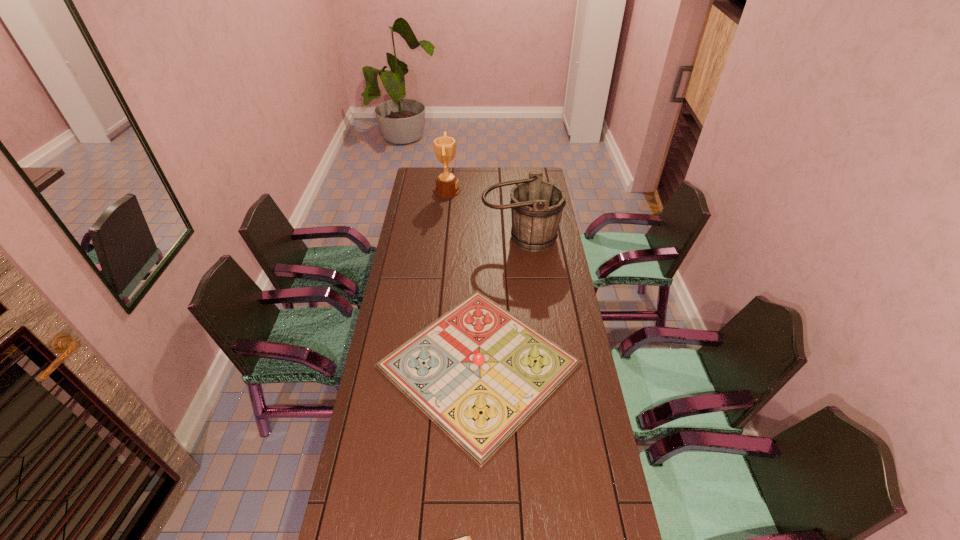
In order to click on bucket located in the right edge section of the desktop in this screenshot , I will do `click(536, 206)`.

At what (x,y) coordinates should I click in order to perform the action: click on gameboard that is at the right edge. Please return your answer as a coordinate pair (x, y). Looking at the image, I should click on (478, 372).

You are a GUI agent. You are given a task and a screenshot of the screen. Output one action in this format:
    pyautogui.click(x=<x>, y=<y>)
    Task: Click on the object positioned at the far left corner
    This screenshot has width=960, height=540.
    Given the screenshot: What is the action you would take?
    pyautogui.click(x=447, y=185)

In the image, there is a desktop. Identify the location of vacant space at the far edge. (492, 185).

The width and height of the screenshot is (960, 540). In the image, there is a desktop. In order to click on vacant space at the left edge in this screenshot , I will do `click(401, 302)`.

This screenshot has width=960, height=540. Identify the location of vacant space at the right edge of the desktop. (573, 513).

Find the location of `vacant area at the far left corner`. vacant area at the far left corner is located at coordinates (415, 182).

Where is `unoccupied area between the gameboard and the second farthest object`? Image resolution: width=960 pixels, height=540 pixels. unoccupied area between the gameboard and the second farthest object is located at coordinates (499, 301).

Locate an element on the screen. This screenshot has width=960, height=540. vacant point located between the farthest object and the third tallest object is located at coordinates (463, 277).

Image resolution: width=960 pixels, height=540 pixels. Identify the location of free spot between the second farthest object and the third tallest object. (499, 301).